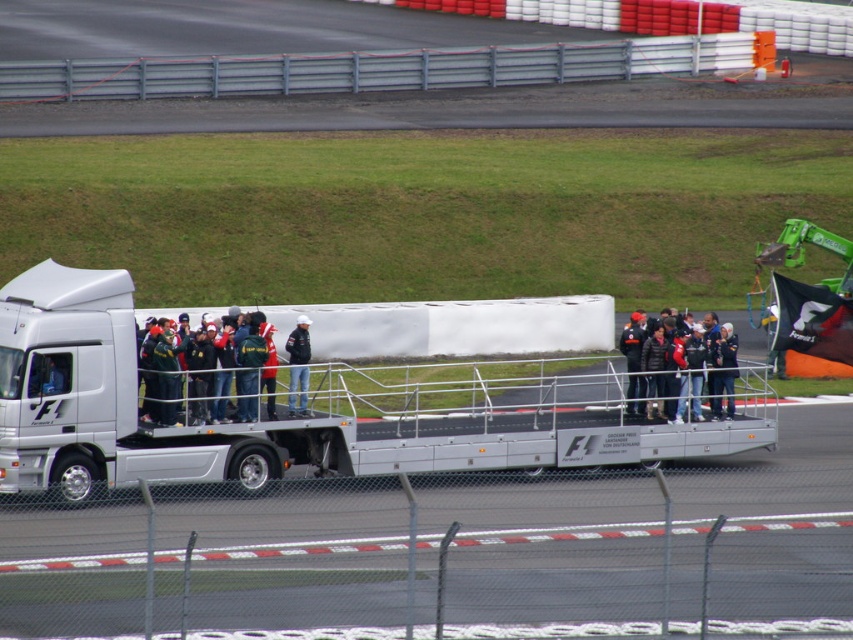
How much distance is there between silver metallic flatbed truck at center and dark green fabric jacket at center?

silver metallic flatbed truck at center is 1.62 meters away from dark green fabric jacket at center.

Looking at this image, who is more forward, (387, 401) or (202, 321)?

Point (202, 321) is more forward.

This screenshot has height=640, width=853. Identify the location of silver metallic flatbed truck at center. (311, 410).

The image size is (853, 640). Find the location of `silver metallic flatbed truck at center`. silver metallic flatbed truck at center is located at coordinates [x=311, y=410].

Does point (207, 458) come behind point (289, 344)?

That is False.

In order to click on silver metallic flatbed truck at center in this screenshot , I will do `click(311, 410)`.

Does dark green fabric jacket at center have a lesser width compared to denim jeans at center?

No.

Which is above, dark green fabric jacket at center or denim jeans at center?

denim jeans at center

Where is `dark green fabric jacket at center`? dark green fabric jacket at center is located at coordinates (241, 365).